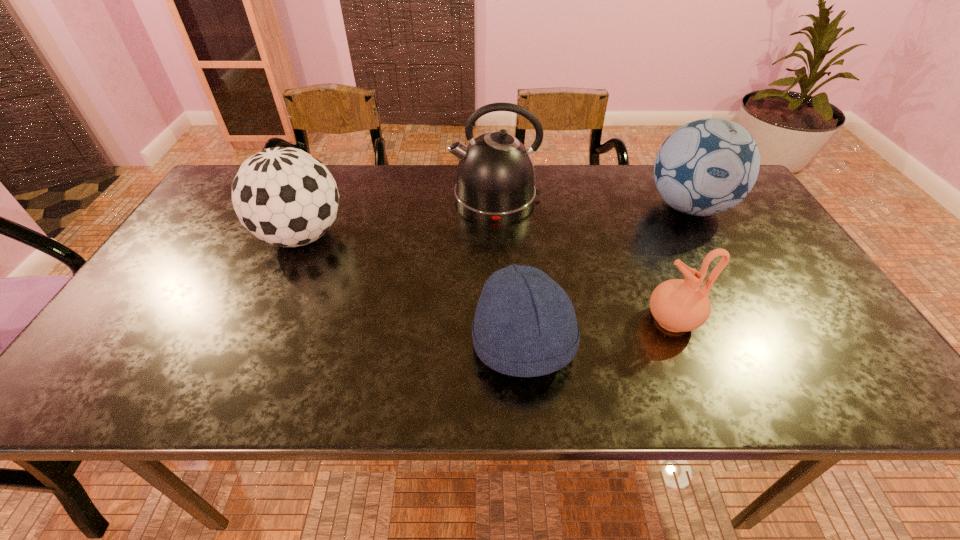
Locate an element on the screen. The height and width of the screenshot is (540, 960). vacant space located on the spout of the pottery is located at coordinates 601,320.

The width and height of the screenshot is (960, 540). I want to click on vacant area situated on the spout of the pottery, so click(485, 320).

At what (x,y) coordinates should I click in order to perform the action: click on free space located on the spout of the pottery. Please return your answer as a coordinate pair (x, y). The width and height of the screenshot is (960, 540). Looking at the image, I should click on (569, 320).

Find the location of a particular element. The height and width of the screenshot is (540, 960). vacant point located on the right of the shortest object is located at coordinates pos(743,344).

Where is `kettle located at the far edge`? The height and width of the screenshot is (540, 960). kettle located at the far edge is located at coordinates [495, 176].

Identify the location of soccer ball at the far edge. Image resolution: width=960 pixels, height=540 pixels. (705, 167).

You are a GUI agent. You are given a task and a screenshot of the screen. Output one action in this format:
    pyautogui.click(x=<x>, y=<y>)
    Task: Click on the object that is at the near edge
    The height and width of the screenshot is (540, 960).
    Given the screenshot: What is the action you would take?
    pyautogui.click(x=525, y=325)

The width and height of the screenshot is (960, 540). I want to click on object that is at the right edge, so click(x=705, y=167).

Image resolution: width=960 pixels, height=540 pixels. Find the location of `object that is at the far right corner`. object that is at the far right corner is located at coordinates (705, 167).

What are the coordinates of `vacant space at the far edge of the desktop` in the screenshot? It's located at 405,173.